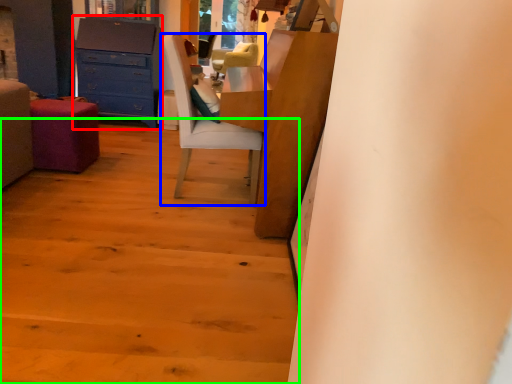
Question: Which is nearer to the chest of drawers (highlighted by a red box)? chair (highlighted by a blue box) or stairwell (highlighted by a green box).

Choices:
 (A) chair
 (B) stairwell

Answer: (A)